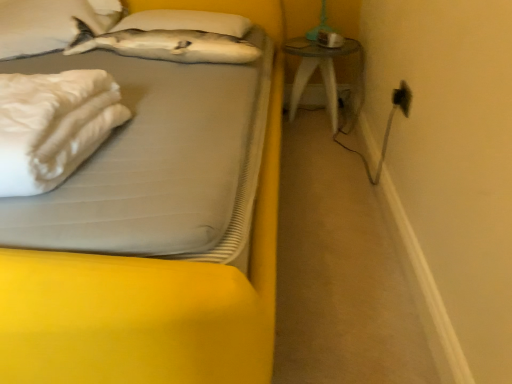
Question: Is the depth of black plastic electric outlet at upper right greater than that of transparent glass table at right?

Choices:
 (A) no
 (B) yes

Answer: (A)

Question: Can you confirm if black plastic electric outlet at upper right is positioned to the left of transparent glass table at right?

Choices:
 (A) yes
 (B) no

Answer: (B)

Question: Is black plastic electric outlet at upper right not near transparent glass table at right?

Choices:
 (A) yes
 (B) no

Answer: (B)

Question: Does black plastic electric outlet at upper right have a smaller size compared to transparent glass table at right?

Choices:
 (A) yes
 (B) no

Answer: (A)

Question: Is black plastic electric outlet at upper right taller than transparent glass table at right?

Choices:
 (A) no
 (B) yes

Answer: (A)

Question: Considering the relative positions of white soft bed at upper left and white soft pillow at upper center, which is the second pillow from left to right, in the image provided, is white soft bed at upper left to the left or to the right of white soft pillow at upper center, which is the second pillow from left to right,?

Choices:
 (A) left
 (B) right

Answer: (A)

Question: From the image's perspective, relative to white soft pillow at upper center, which is the second pillow from left to right, is white soft bed at upper left above or below?

Choices:
 (A) below
 (B) above

Answer: (A)

Question: Considering the positions of white soft bed at upper left and white soft pillow at upper center, which is the second pillow from left to right, in the image, is white soft bed at upper left bigger or smaller than white soft pillow at upper center, which is the second pillow from left to right,?

Choices:
 (A) big
 (B) small

Answer: (A)

Question: From a real-world perspective, is white soft bed at upper left above or below white soft pillow at upper center, which is the second pillow from left to right?

Choices:
 (A) below
 (B) above

Answer: (A)

Question: Considering the positions of white soft pillow at upper center, marked as the 1th pillow in a right-to-left arrangement, and white matte pillow at upper left, which is counted as the 2th pillow, starting from the right, in the image, is white soft pillow at upper center, marked as the 1th pillow in a right-to-left arrangement, taller or shorter than white matte pillow at upper left, which is counted as the 2th pillow, starting from the right,?

Choices:
 (A) short
 (B) tall

Answer: (A)

Question: From the image's perspective, relative to white matte pillow at upper left, which is counted as the 2th pillow, starting from the right, is white soft pillow at upper center, which is the second pillow from left to right, above or below?

Choices:
 (A) below
 (B) above

Answer: (B)

Question: Which is correct: white soft pillow at upper center, which is the second pillow from left to right, is inside white matte pillow at upper left, which is counted as the 2th pillow, starting from the right, or outside of it?

Choices:
 (A) outside
 (B) inside

Answer: (A)

Question: Based on their sizes in the image, would you say white soft pillow at upper center, which is the second pillow from left to right, is bigger or smaller than white matte pillow at upper left, which is counted as the 2th pillow, starting from the right?

Choices:
 (A) small
 (B) big

Answer: (A)

Question: Would you say white soft pillow at upper center, which is the second pillow from left to right, is inside or outside transparent glass table at right?

Choices:
 (A) outside
 (B) inside

Answer: (A)

Question: Looking at their shapes, would you say white soft pillow at upper center, which is the second pillow from left to right, is wider or thinner than transparent glass table at right?

Choices:
 (A) wide
 (B) thin

Answer: (A)